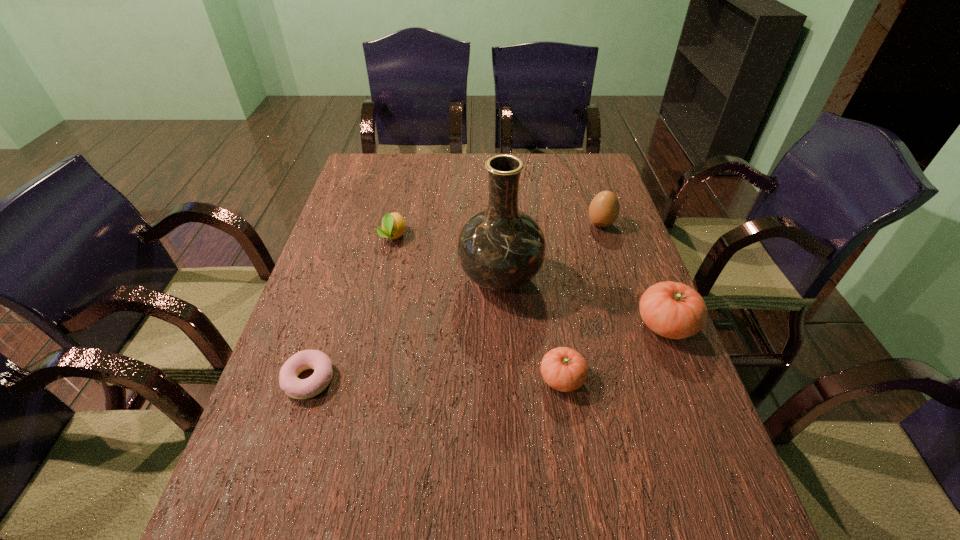
Find the location of a particular element. vacant area at the left edge is located at coordinates (343, 272).

This screenshot has width=960, height=540. In the image, there is a desktop. Find the location of `vacant space at the right edge`. vacant space at the right edge is located at coordinates (640, 256).

This screenshot has height=540, width=960. In order to click on blank space at the far left corner in this screenshot , I will do `click(392, 158)`.

Where is `free space at the far right corner of the desktop`? The image size is (960, 540). free space at the far right corner of the desktop is located at coordinates (587, 163).

Where is `empty space between the fifth object from right to left and the vase`? This screenshot has width=960, height=540. empty space between the fifth object from right to left and the vase is located at coordinates (446, 258).

The width and height of the screenshot is (960, 540). What are the coordinates of `free area in between the tallest object and the left tomato` in the screenshot? It's located at (531, 329).

Locate an element on the screen. The image size is (960, 540). vacant space in between the lemon and the shorter tomato is located at coordinates (477, 307).

I want to click on unoccupied area between the nearer tomato and the farther tomato, so click(x=614, y=352).

You are a GUI agent. You are given a task and a screenshot of the screen. Output one action in this format:
    pyautogui.click(x=<x>, y=<y>)
    Task: Click on the free space between the farther tomato and the boiled egg
    The height and width of the screenshot is (540, 960).
    Given the screenshot: What is the action you would take?
    pyautogui.click(x=634, y=274)

The width and height of the screenshot is (960, 540). I want to click on vacant area between the boiled egg and the nearer tomato, so click(x=582, y=301).